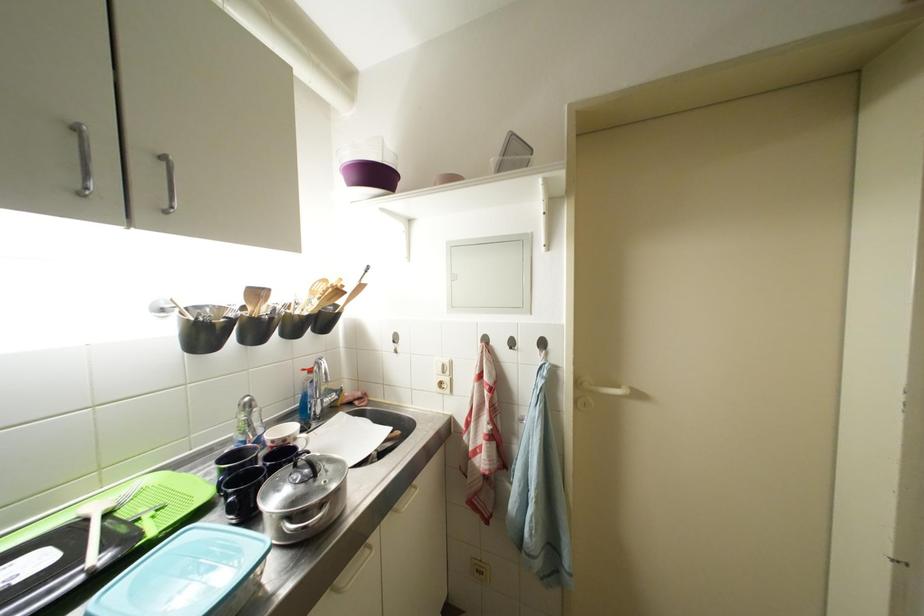
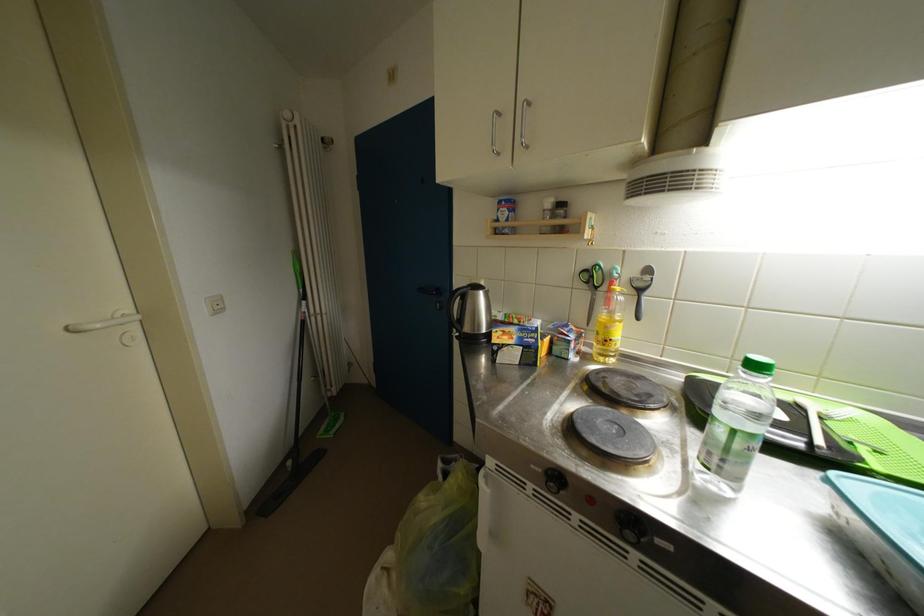
Based on the continuous images, in which direction is the camera rotating?

The camera's rotation is toward left-down.